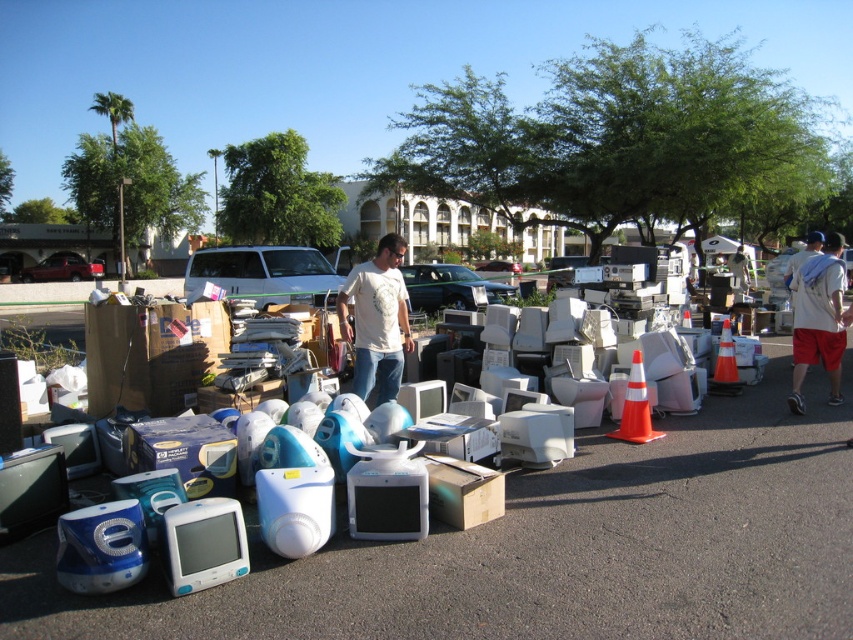
Question: Can you confirm if white t-shirt at center is smaller than white cotton shirt at center?

Choices:
 (A) no
 (B) yes

Answer: (A)

Question: Which object is closer to the camera taking this photo?

Choices:
 (A) white t-shirt at center
 (B) white cotton shirt at center

Answer: (A)

Question: Which point is farther from the camera taking this photo?

Choices:
 (A) (384, 248)
 (B) (819, 324)

Answer: (B)

Question: Observing the image, what is the correct spatial positioning of white t-shirt at center in reference to white cotton shirt at center?

Choices:
 (A) below
 (B) above

Answer: (A)

Question: Is white t-shirt at center wider than white cotton shirt at center?

Choices:
 (A) no
 (B) yes

Answer: (B)